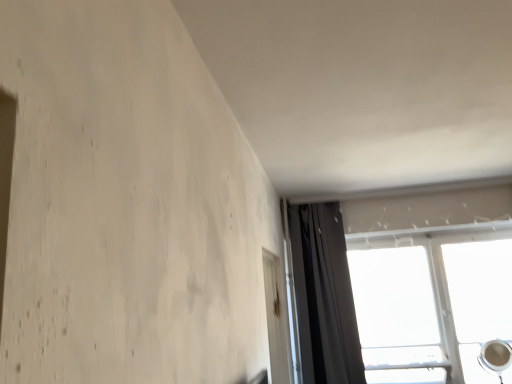
Question: Could dark gray fabric curtain at upper right be considered to be inside transparent plastic screen door at lower right?

Choices:
 (A) yes
 (B) no

Answer: (B)

Question: Would you say transparent plastic screen door at lower right is outside dark gray fabric curtain at upper right?

Choices:
 (A) no
 (B) yes

Answer: (B)

Question: Can you confirm if transparent plastic screen door at lower right is shorter than dark gray fabric curtain at upper right?

Choices:
 (A) no
 (B) yes

Answer: (B)

Question: Is transparent plastic screen door at lower right bigger than dark gray fabric curtain at upper right?

Choices:
 (A) yes
 (B) no

Answer: (B)

Question: From the image's perspective, is transparent plastic screen door at lower right over dark gray fabric curtain at upper right?

Choices:
 (A) no
 (B) yes

Answer: (A)

Question: Considering the relative positions of dark gray fabric curtain at upper right and transparent plastic screen door at lower right in the image provided, is dark gray fabric curtain at upper right to the left or to the right of transparent plastic screen door at lower right?

Choices:
 (A) left
 (B) right

Answer: (B)

Question: In terms of height, does dark gray fabric curtain at upper right look taller or shorter compared to transparent plastic screen door at lower right?

Choices:
 (A) short
 (B) tall

Answer: (B)

Question: From a real-world perspective, is dark gray fabric curtain at upper right positioned above or below transparent plastic screen door at lower right?

Choices:
 (A) below
 (B) above

Answer: (B)

Question: Is point (343, 264) positioned closer to the camera than point (283, 359)?

Choices:
 (A) closer
 (B) farther

Answer: (B)

Question: Which is correct: transparent glass window at upper right is inside dark gray fabric curtain at upper right, or outside of it?

Choices:
 (A) outside
 (B) inside

Answer: (A)

Question: Is transparent glass window at upper right in front of or behind dark gray fabric curtain at upper right in the image?

Choices:
 (A) front
 (B) behind

Answer: (B)

Question: Considering the positions of transparent glass window at upper right and dark gray fabric curtain at upper right in the image, is transparent glass window at upper right taller or shorter than dark gray fabric curtain at upper right?

Choices:
 (A) short
 (B) tall

Answer: (A)

Question: In terms of width, does transparent glass window at upper right look wider or thinner when compared to dark gray fabric curtain at upper right?

Choices:
 (A) wide
 (B) thin

Answer: (B)

Question: From the image's perspective, relative to transparent plastic screen door at lower right, is transparent glass window at upper right above or below?

Choices:
 (A) below
 (B) above

Answer: (A)

Question: Considering the positions of point (448, 210) and point (265, 296), is point (448, 210) closer or farther from the camera than point (265, 296)?

Choices:
 (A) farther
 (B) closer

Answer: (A)